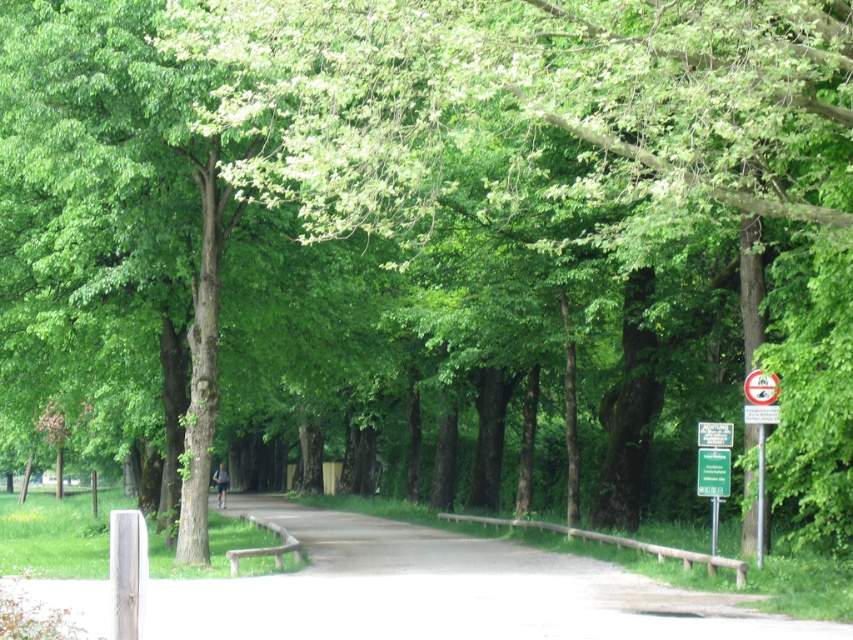
Question: Considering the relative positions of smooth asphalt path at center and wooden bench at center in the image provided, where is smooth asphalt path at center located with respect to wooden bench at center?

Choices:
 (A) above
 (B) below

Answer: (A)

Question: Among these objects, which one is farthest from the camera?

Choices:
 (A) wooden bench at center
 (B) white plastic sign at upper right
 (C) smooth asphalt path at center

Answer: (A)

Question: Is wooden bench at center behind white plastic sign at upper right?

Choices:
 (A) no
 (B) yes

Answer: (B)

Question: Which point appears farthest from the camera in this image?

Choices:
 (A) (337, 589)
 (B) (746, 380)

Answer: (B)

Question: Among these points, which one is farthest from the camera?

Choices:
 (A) (756, 385)
 (B) (267, 528)
 (C) (245, 625)

Answer: (B)

Question: Does wooden bench at center come behind white plastic sign at upper right?

Choices:
 (A) no
 (B) yes

Answer: (B)